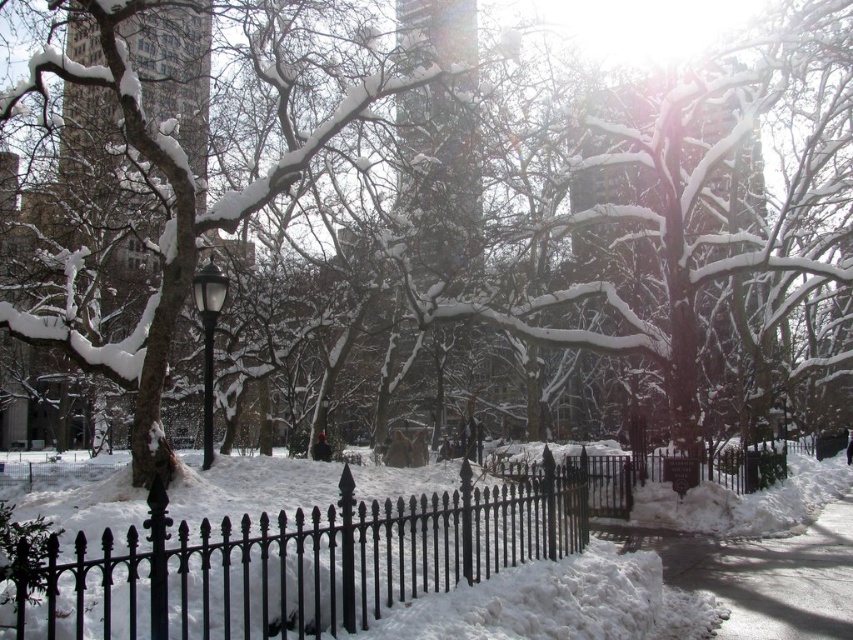
You are standing in the winter park scene. There are two points marked in the image, one at coordinates point (x=525, y=541) and another at point (x=103, y=74). Which point is closer to your current position?

Point (x=525, y=541) is closer to the camera than point (x=103, y=74), so the point at coordinates point (x=525, y=541) is closer to your current position.

Based on the photo, you are standing in the snowy park and want to take a photo of the black wrought iron fence at center and the smooth glass tower at center. Which object should you focus on first if you want to capture both in a single frame without moving the camera?

The black wrought iron fence at center is below the smooth glass tower at center, so you should focus on the smooth glass tower at center first to ensure both are in the frame.